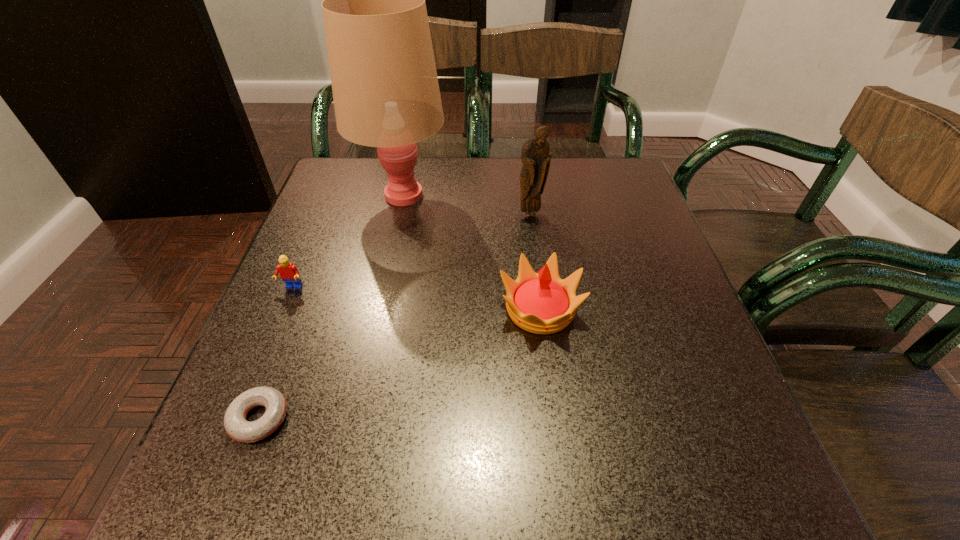
The height and width of the screenshot is (540, 960). Find the location of `unoccupied position between the shortest object and the fourth shortest object`. unoccupied position between the shortest object and the fourth shortest object is located at coordinates (395, 316).

This screenshot has width=960, height=540. Find the location of `vacant space that's between the figurine and the lampshade`. vacant space that's between the figurine and the lampshade is located at coordinates (467, 204).

Find the location of `the closest object to the lampshade`. the closest object to the lampshade is located at coordinates (535, 157).

Locate which object ranks third in proximity to the figurine. Please provide its 2D coordinates. Your answer should be formatted as a tuple, i.e. [(x, y)], where the tuple contains the x and y coordinates of a point satisfying the conditions above.

[(289, 274)]

The width and height of the screenshot is (960, 540). I want to click on free spot that satisfies the following two spatial constraints: 1. on the front-facing side of the nearest object; 2. on the left side of the second shortest object, so click(x=238, y=418).

Where is `free space that satisfies the following two spatial constraints: 1. on the front-facing side of the second shortest object; 2. on the left side of the doughnut`? The width and height of the screenshot is (960, 540). free space that satisfies the following two spatial constraints: 1. on the front-facing side of the second shortest object; 2. on the left side of the doughnut is located at coordinates (238, 418).

Locate an element on the screen. The height and width of the screenshot is (540, 960). free region that satisfies the following two spatial constraints: 1. on the front side of the crown; 2. on the left side of the tallest object is located at coordinates (377, 309).

Image resolution: width=960 pixels, height=540 pixels. Find the location of `free space that satisfies the following two spatial constraints: 1. on the front-facing side of the Lego; 2. on the right side of the doughnut`. free space that satisfies the following two spatial constraints: 1. on the front-facing side of the Lego; 2. on the right side of the doughnut is located at coordinates (238, 418).